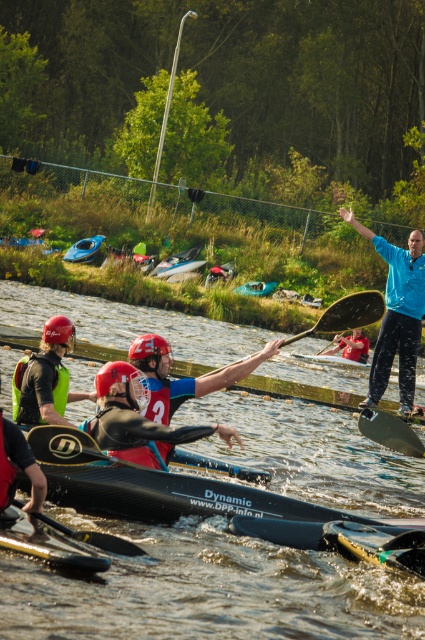
Question: Does matte black helmet at center appear on the left side of blue rubber boat at center?

Choices:
 (A) no
 (B) yes

Answer: (A)

Question: Which of the following is the farthest from the observer?

Choices:
 (A) matte black kayak at center
 (B) black matte paddle at center

Answer: (A)

Question: Which object appears closest to the camera in this image?

Choices:
 (A) matte black helmet at center
 (B) blue rubber boat at center
 (C) matte black kayak at center

Answer: (A)

Question: Which point is farther to the camera?

Choices:
 (A) (73, 260)
 (B) (348, 355)
 (C) (116, 392)

Answer: (A)

Question: Can you confirm if black rubber paddle at lower center is smaller than matte black kayak at center?

Choices:
 (A) no
 (B) yes

Answer: (B)

Question: Is blue matte jacket at upper right positioned at the back of black smooth paddle at center?

Choices:
 (A) no
 (B) yes

Answer: (B)